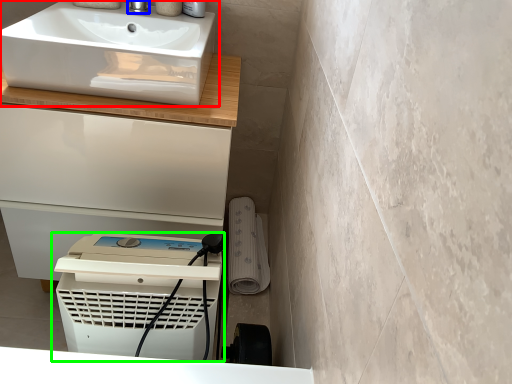
Question: Based on their relative distances, which object is nearer to sink (highlighted by a red box)? Choose from tap (highlighted by a blue box) and home appliance (highlighted by a green box).

Choices:
 (A) tap
 (B) home appliance

Answer: (A)